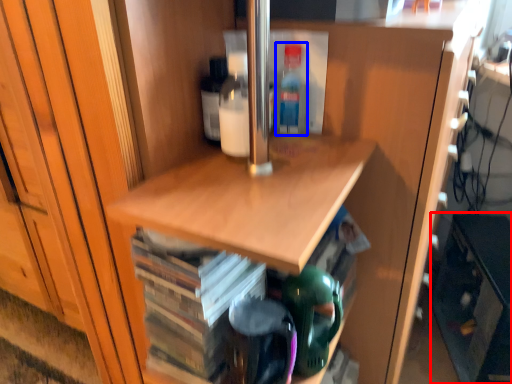
Question: Which of the following is the closest to the observer, cabinetry (highlighted by a red box) or bottle (highlighted by a blue box)?

Choices:
 (A) cabinetry
 (B) bottle

Answer: (B)